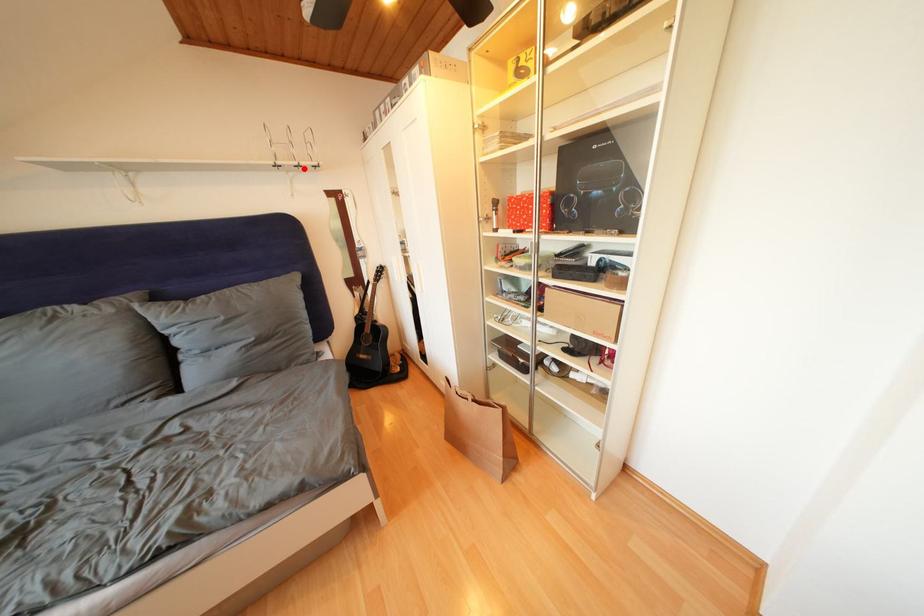
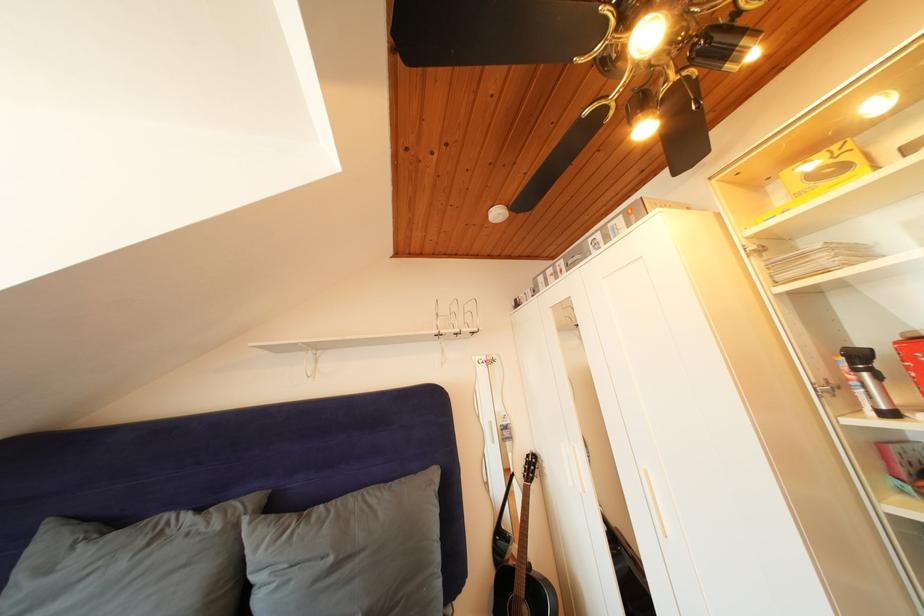
Find the pixel in the second image that matches the highlighted location in the first image.

(466, 336)